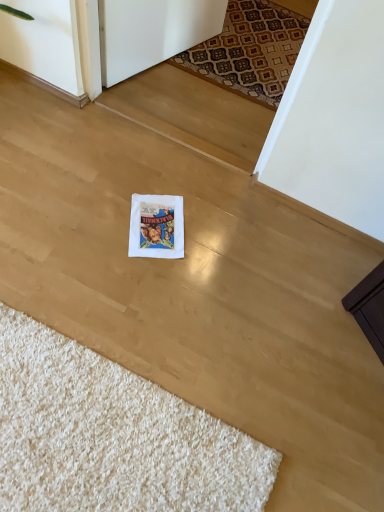
The image size is (384, 512). I want to click on patterned carpet at upper center, so click(x=250, y=51).

Identify the location of white paper postcard at center. This screenshot has height=512, width=384. (156, 226).

Between white shaggy rug at lower left and white paper postcard at center, which one appears on the left side from the viewer's perspective?

white shaggy rug at lower left.

Is there a large distance between white shaggy rug at lower left and white paper postcard at center?

No, white shaggy rug at lower left is in close proximity to white paper postcard at center.

Which of these two, white shaggy rug at lower left or white paper postcard at center, is bigger?

white shaggy rug at lower left.

Is white shaggy rug at lower left aimed at white paper postcard at center?

No, white shaggy rug at lower left does not turn towards white paper postcard at center.

Consider the image. Would you say patterned carpet at upper center is to the left or to the right of white shaggy rug at lower left in the picture?

From the image, it's evident that patterned carpet at upper center is to the right of white shaggy rug at lower left.

Which object is thinner, patterned carpet at upper center or white shaggy rug at lower left?

patterned carpet at upper center is thinner.

Consider the image. From the image's perspective, which one is positioned lower, patterned carpet at upper center or white shaggy rug at lower left?

white shaggy rug at lower left.

Does patterned carpet at upper center lie in front of white shaggy rug at lower left?

No, patterned carpet at upper center is further to the viewer.

Which object is positioned more to the left, white paper postcard at center or patterned carpet at upper center?

From the viewer's perspective, white paper postcard at center appears more on the left side.

How many degrees apart are the facing directions of white paper postcard at center and patterned carpet at upper center?

The facing directions of white paper postcard at center and patterned carpet at upper center are 28.9 degrees apart.

Is point (129, 242) farther from viewer compared to point (284, 20)?

No.

Considering the relative sizes of white paper postcard at center and patterned carpet at upper center in the image provided, is white paper postcard at center smaller than patterned carpet at upper center?

Yes.

Is point (11, 465) closer or farther from the camera than point (303, 38)?

Point (11, 465) is positioned closer to the camera compared to point (303, 38).

You are a GUI agent. You are given a task and a screenshot of the screen. Output one action in this format:
    pyautogui.click(x=<x>, y=<y>)
    Task: Click on the doormat on the left of patterned carpet at upper center
    The height and width of the screenshot is (512, 384).
    Given the screenshot: What is the action you would take?
    pyautogui.click(x=112, y=436)

From a real-world perspective, which is physically above, white shaggy rug at lower left or patterned carpet at upper center?

In real-world perspective, white shaggy rug at lower left is above.

Looking at the image, does white shaggy rug at lower left seem bigger or smaller compared to patterned carpet at upper center?

Clearly, white shaggy rug at lower left is larger in size than patterned carpet at upper center.

Does patterned carpet at upper center have a lesser height compared to white paper postcard at center?

Incorrect, the height of patterned carpet at upper center does not fall short of that of white paper postcard at center.

Considering the sizes of objects patterned carpet at upper center and white paper postcard at center in the image provided, who is thinner, patterned carpet at upper center or white paper postcard at center?

white paper postcard at center.

From the image's perspective, which one is positioned higher, patterned carpet at upper center or white paper postcard at center?

patterned carpet at upper center is shown above in the image.

Considering the relative positions of patterned carpet at upper center and white paper postcard at center in the image provided, is patterned carpet at upper center behind white paper postcard at center?

Yes, it is behind white paper postcard at center.

Is white paper postcard at center situated inside white shaggy rug at lower left or outside?

white paper postcard at center cannot be found inside white shaggy rug at lower left.

Looking at this image, which object is more forward, white paper postcard at center or white shaggy rug at lower left?

white shaggy rug at lower left.

Would you say white paper postcard at center is a long distance from white shaggy rug at lower left?

No, there isn't a large distance between white paper postcard at center and white shaggy rug at lower left.

Does point (147, 211) come farther from viewer compared to point (29, 473)?

Yes.

Find the location of a particular element. The image size is (384, 512). postcard on the right of the white shaggy rug at lower left is located at coordinates coord(156,226).

At what (x,y) coordinates should I click in order to perform the action: click on doormat below the patterned carpet at upper center (from the image's perspective). Please return your answer as a coordinate pair (x, y). Looking at the image, I should click on (112, 436).

Looking at the image, which one is located further to white paper postcard at center, patterned carpet at upper center or white shaggy rug at lower left?

patterned carpet at upper center is further to white paper postcard at center.

Estimate the real-world distances between objects in this image. Which object is further from white shaggy rug at lower left, white paper postcard at center or patterned carpet at upper center?

Among the two, patterned carpet at upper center is located further to white shaggy rug at lower left.

When comparing their distances from patterned carpet at upper center, does white shaggy rug at lower left or white paper postcard at center seem further?

white shaggy rug at lower left is positioned further to the anchor patterned carpet at upper center.

Estimate the real-world distances between objects in this image. Which object is further from patterned carpet at upper center, white paper postcard at center or white shaggy rug at lower left?

white shaggy rug at lower left.

Which object lies nearer to the anchor point white paper postcard at center, white shaggy rug at lower left or patterned carpet at upper center?

The object closer to white paper postcard at center is white shaggy rug at lower left.

Considering their positions, is patterned carpet at upper center positioned further to white shaggy rug at lower left than white paper postcard at center?

The object further to white shaggy rug at lower left is patterned carpet at upper center.

This screenshot has width=384, height=512. Find the location of `postcard that lies between patterned carpet at upper center and white shaggy rug at lower left from top to bottom`. postcard that lies between patterned carpet at upper center and white shaggy rug at lower left from top to bottom is located at coordinates (156, 226).